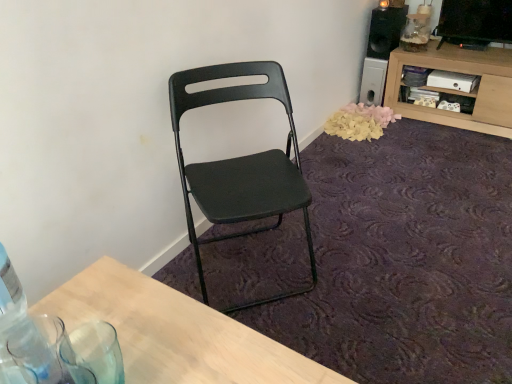
Question: From a real-world perspective, is black matte speaker at upper right on matte black folding chair at center?

Choices:
 (A) yes
 (B) no

Answer: (A)

Question: Could you tell me if black matte speaker at upper right is turned towards matte black folding chair at center?

Choices:
 (A) yes
 (B) no

Answer: (A)

Question: From the image's perspective, is black matte speaker at upper right beneath matte black folding chair at center?

Choices:
 (A) no
 (B) yes

Answer: (A)

Question: Does black matte speaker at upper right have a lesser height compared to matte black folding chair at center?

Choices:
 (A) no
 (B) yes

Answer: (B)

Question: Are black matte speaker at upper right and matte black folding chair at center making contact?

Choices:
 (A) yes
 (B) no

Answer: (B)

Question: Can you confirm if black matte speaker at upper right is positioned to the left of matte black folding chair at center?

Choices:
 (A) no
 (B) yes

Answer: (A)

Question: From a real-world perspective, is matte black folding chair at center on black matte speaker at upper right?

Choices:
 (A) yes
 (B) no

Answer: (B)

Question: From a real-world perspective, is matte black folding chair at center positioned under black matte speaker at upper right based on gravity?

Choices:
 (A) yes
 (B) no

Answer: (A)

Question: Is matte black folding chair at center facing towards black matte speaker at upper right?

Choices:
 (A) yes
 (B) no

Answer: (B)

Question: Considering the relative sizes of matte black folding chair at center and black matte speaker at upper right in the image provided, is matte black folding chair at center wider than black matte speaker at upper right?

Choices:
 (A) no
 (B) yes

Answer: (B)

Question: Can you see matte black folding chair at center touching black matte speaker at upper right?

Choices:
 (A) yes
 (B) no

Answer: (B)

Question: Does matte black folding chair at center have a larger size compared to black matte speaker at upper right?

Choices:
 (A) no
 (B) yes

Answer: (B)

Question: Does matte black folding chair at center have a larger size compared to wooden cabinet at upper right?

Choices:
 (A) no
 (B) yes

Answer: (B)